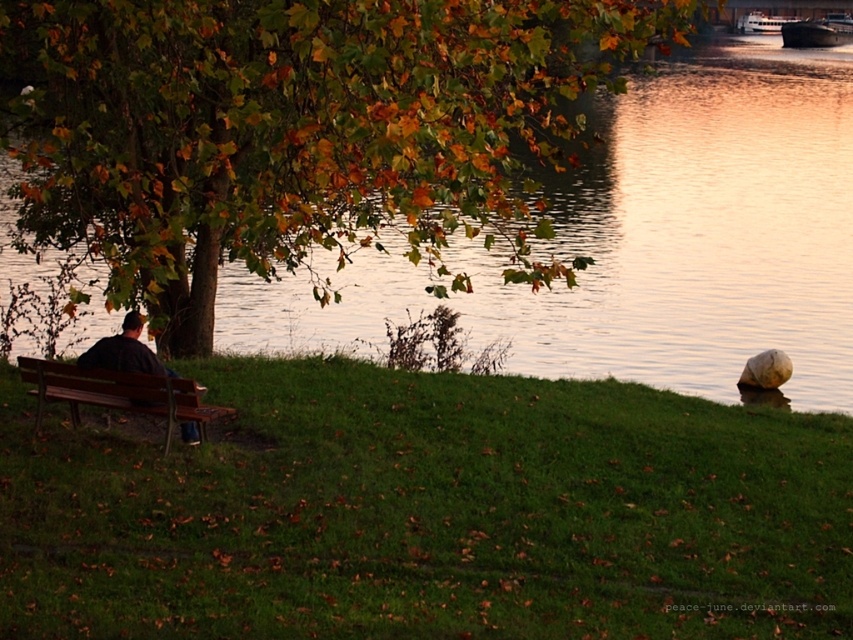
You are standing at the center of the grassy area and want to take a photo of the green leafy tree at upper left. In which direction should you face to capture the tree in your camera view?

The green leafy tree at upper left is located at point (x=297, y=131), so you should face towards the upper left direction to capture it in your camera view.

In the scene shown: You are a photographer planning to take a portrait of the person sitting on the brown wooden bench at lower left. To ensure the green leafy tree at upper left does not block the person in the photo, how should you position yourself relative to the bench?

Position yourself to the side of the brown wooden bench at lower left so that the shorter bench is between you and the taller green leafy tree at upper left, ensuring the tree does not block the view of the person.